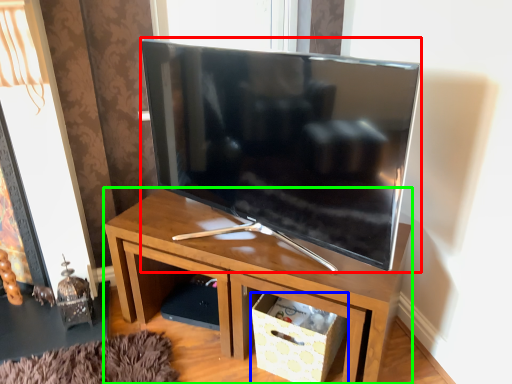
Question: Which object is positioned closest to television (highlighted by a red box)? Select from storage box (highlighted by a blue box) and desk (highlighted by a green box).

Choices:
 (A) storage box
 (B) desk

Answer: (B)